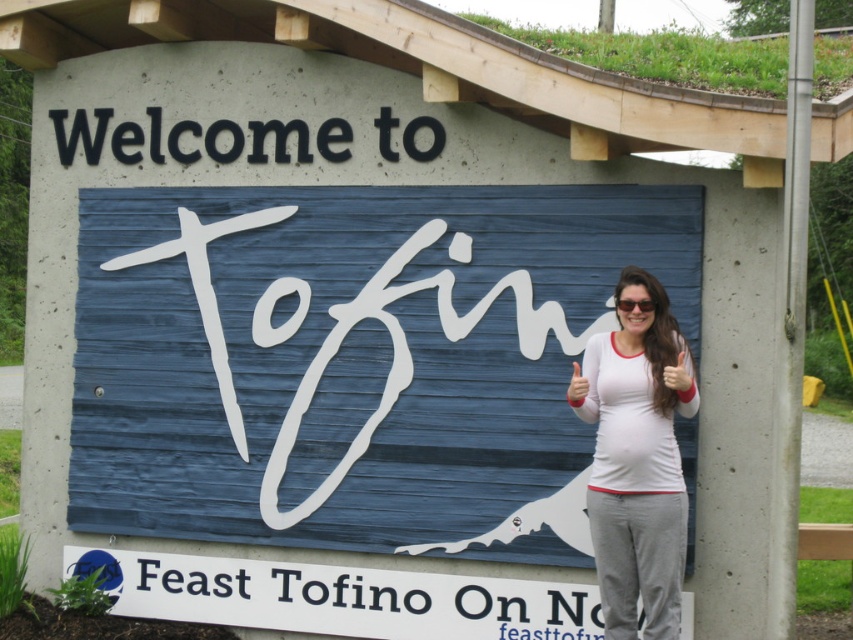
Who is higher up, black plastic sign at upper center or matte white sunglasses at center?

black plastic sign at upper center is higher up.

Does black plastic sign at upper center have a greater height compared to matte white sunglasses at center?

Yes.

Is point (256, 129) less distant than point (625, 301)?

No, it is behind (625, 301).

The width and height of the screenshot is (853, 640). What are the coordinates of `black plastic sign at upper center` in the screenshot? It's located at click(229, 140).

Is white cotton shirt at center behind black plastic sign at upper center?

No, white cotton shirt at center is closer to the viewer.

Is white cotton shirt at center to the right of black plastic sign at upper center from the viewer's perspective?

Correct, you'll find white cotton shirt at center to the right of black plastic sign at upper center.

Where is `white cotton shirt at center`? white cotton shirt at center is located at coordinates (637, 460).

Measure the distance between white plastic sign at lower center and camera.

A distance of 24.12 feet exists between white plastic sign at lower center and camera.

What do you see at coordinates (338, 596) in the screenshot? This screenshot has width=853, height=640. I see `white plastic sign at lower center` at bounding box center [338, 596].

Find the location of a particular element. white plastic sign at lower center is located at coordinates (338, 596).